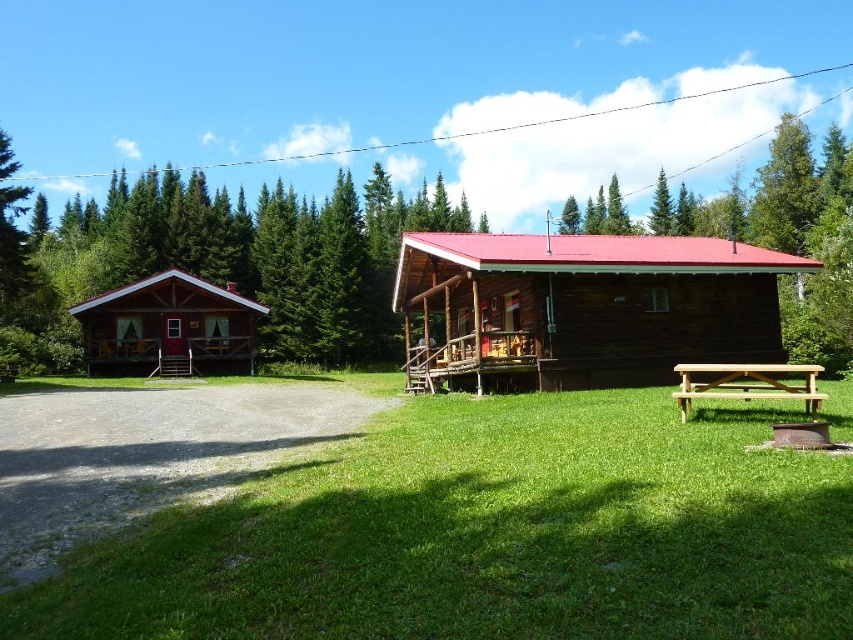
Question: Among these points, which one is nearest to the camera?

Choices:
 (A) (664, 232)
 (B) (751, 380)

Answer: (B)

Question: Estimate the real-world distances between objects in this image. Which object is farther from the wooden cabin at left?

Choices:
 (A) green grass at lower center
 (B) light brown wooden picnic table at lower right
 (C) brown wooden cabin at center
 (D) green textured trees at upper center

Answer: (B)

Question: Which of the following is the closest to the observer?

Choices:
 (A) brown wooden cabin at center
 (B) green textured trees at upper center
 (C) wooden cabin at left
 (D) green grass at lower center

Answer: (D)

Question: Is green grass at lower center to the left of brown wooden cabin at center from the viewer's perspective?

Choices:
 (A) yes
 (B) no

Answer: (A)

Question: Does green grass at lower center come behind green textured pine tree at upper center?

Choices:
 (A) yes
 (B) no

Answer: (B)

Question: Is green textured trees at upper center to the right of brown wooden cabin at center from the viewer's perspective?

Choices:
 (A) no
 (B) yes

Answer: (A)